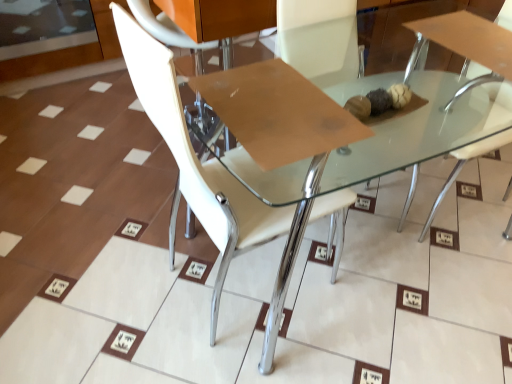
This screenshot has height=384, width=512. In order to click on vacant space positioned to the left of white glossy chair at center, the 1th chair in the left-to-right sequence in this screenshot , I will do `click(130, 279)`.